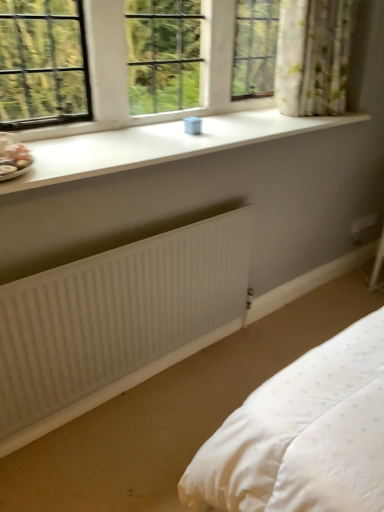
The height and width of the screenshot is (512, 384). Identify the location of free space that is in between matte pink porcelain at left and white plastic container at upper center. (117, 138).